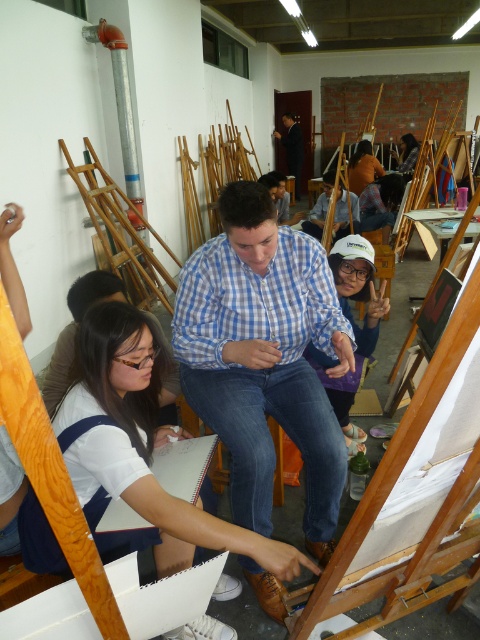
You are an art student observing the scene and need to identify which object is smaller between the blue checkered shirt at center and the matte brown hair at center. Which one is it?

The blue checkered shirt at center is smaller than matte brown hair at center.

You are an art student standing in the studio and you want to locate the blue plaid shirt at center and the matte brown hair at center. Which one is closer to the floor?

The blue plaid shirt at center is positioned under matte brown hair at center, so the blue plaid shirt at center is closer to the floor.

In the art class scene, there is a person wearing a blue plaid shirt at center and another with matte brown hair at center. From the perspective of someone standing at the entrance of the room, which of these two is positioned more to the left side of the room?

The blue plaid shirt at center is positioned to the left of matte brown hair at center, so from the entrance perspective, the blue plaid shirt at center is more to the left side of the room.